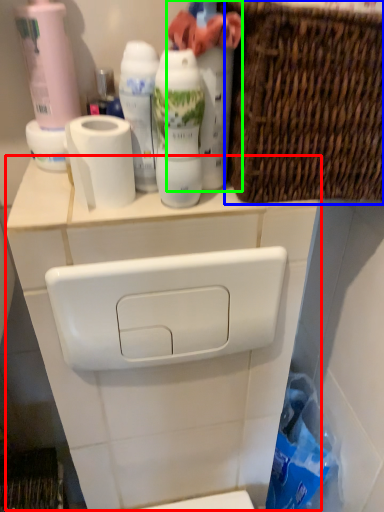
Question: Considering the real-world distances, which object is farthest from counter (highlighted by a red box)? basket (highlighted by a blue box) or cleaning product (highlighted by a green box)?

Choices:
 (A) basket
 (B) cleaning product

Answer: (B)